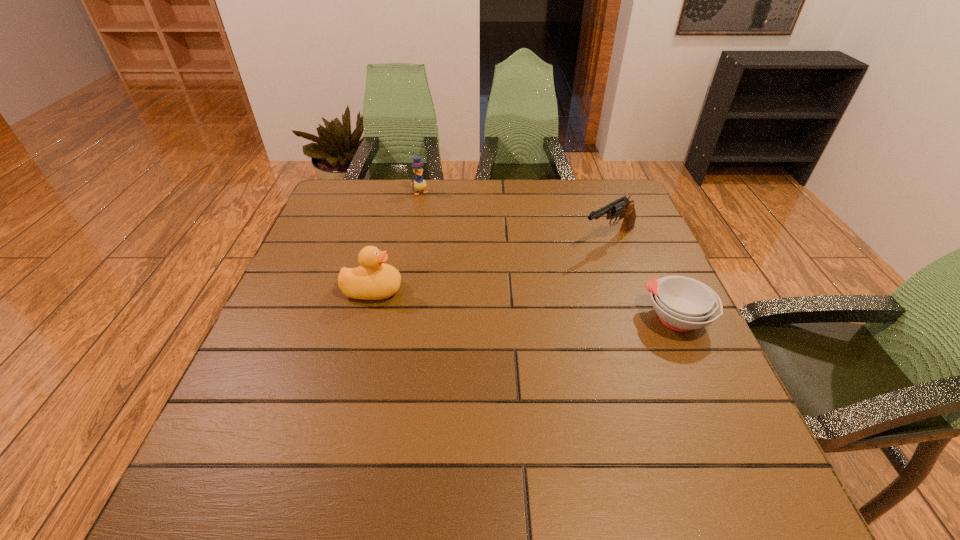
The width and height of the screenshot is (960, 540). What are the coordinates of `free spot on the desktop that is between the duck and the shortest object and is positioned along the barrel of the gun` in the screenshot? It's located at (499, 302).

At what (x,y) coordinates should I click in order to perform the action: click on free space on the desktop that is between the duck and the soup bowl and is positioned on the face of the duckling, where the monocle is placed. Please return your answer as a coordinate pair (x, y). The height and width of the screenshot is (540, 960). Looking at the image, I should click on (490, 301).